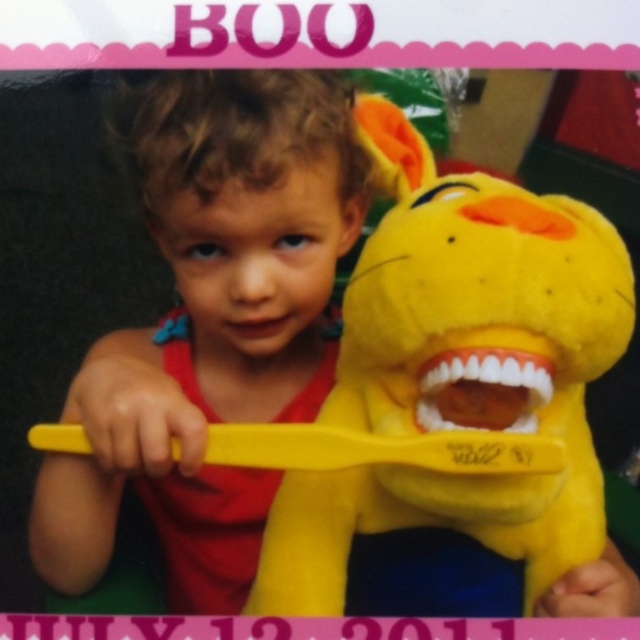
Can you confirm if yellow plastic toothbrush at center is shorter than white matte teeth at center?

Indeed, yellow plastic toothbrush at center has a lesser height compared to white matte teeth at center.

Who is positioned more to the right, yellow plastic toothbrush at center or white matte teeth at center?

Positioned to the right is white matte teeth at center.

In order to click on yellow plastic toothbrush at center in this screenshot , I will do `click(380, 449)`.

I want to click on yellow plastic toothbrush at center, so click(x=380, y=449).

At what (x,y) coordinates should I click in order to perform the action: click on matte yellow toothbrush at center. Please return your answer as a coordinate pair (x, y). Looking at the image, I should click on (205, 323).

This screenshot has width=640, height=640. Describe the element at coordinates (205, 323) in the screenshot. I see `matte yellow toothbrush at center` at that location.

This screenshot has height=640, width=640. I want to click on matte yellow toothbrush at center, so click(x=205, y=323).

Is matte yellow toothbrush at center wider than yellow plush toy at center?

No.

Describe the element at coordinates (205, 323) in the screenshot. I see `matte yellow toothbrush at center` at that location.

This screenshot has width=640, height=640. Identify the location of matte yellow toothbrush at center. (205, 323).